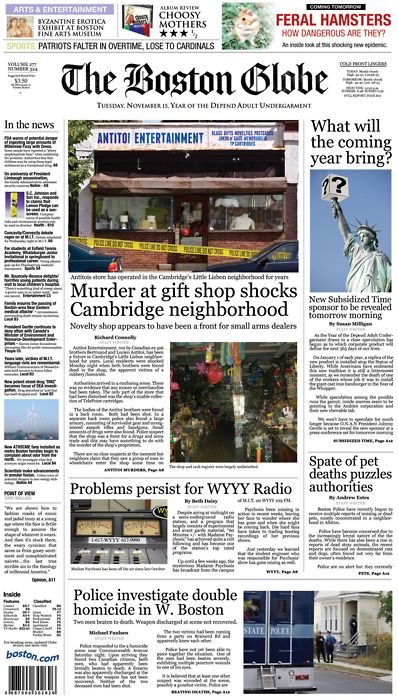
I want to click on stairs, so click(x=343, y=654), click(x=344, y=650), click(x=347, y=644).